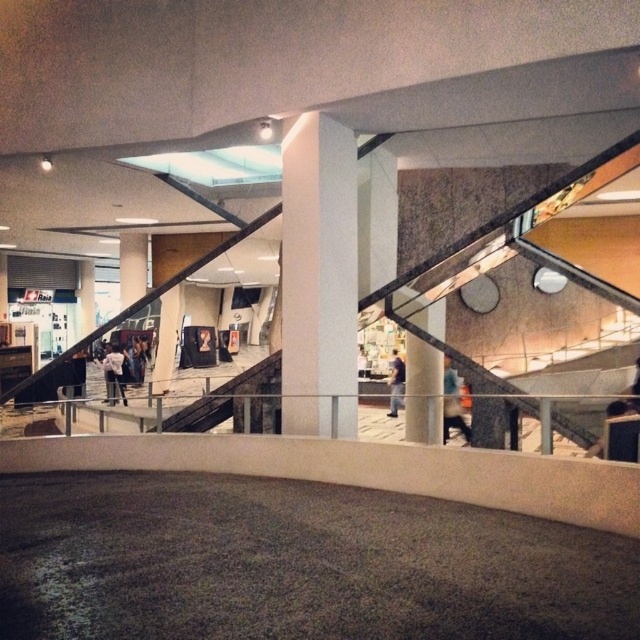
You are a customer in the mall and see the blue fabric jacket at center and the white matte jacket at lower left. Which jacket is located to the right of the other?

The blue fabric jacket at center is positioned on the right side of white matte jacket at lower left.

You are a store employee who needs to place a new display stand between the white matte jacket at lower left and the dark blue jeans at center. The display stand requires at least 1 meter of vertical space. Based on their heights, can the display stand fit vertically between them?

The white matte jacket at lower left is not as tall as dark blue jeans at center. Since the display stand requires at least 1 meter of vertical space, but the height difference between them isn not specified, it is unclear if there is enough space. Please check the actual measurements.